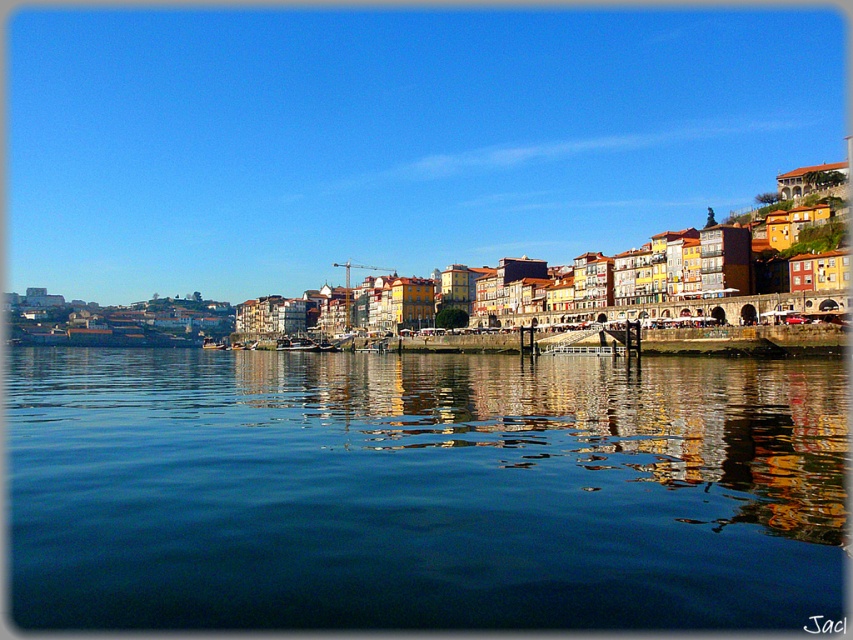
Which is more to the right, transparent blue water at center or wooden boat at center?

From the viewer's perspective, transparent blue water at center appears more on the right side.

Does transparent blue water at center have a greater width compared to wooden boat at center?

Indeed, transparent blue water at center has a greater width compared to wooden boat at center.

Measure the distance between point (x=566, y=428) and camera.

They are 234.54 feet apart.

Locate an element on the screen. This screenshot has width=853, height=640. transparent blue water at center is located at coordinates (422, 490).

Does point (97, 605) come in front of point (223, 348)?

Yes, point (97, 605) is closer to viewer.

Between transparent blue water at center and wooden boat at lower left, which one is positioned lower?

transparent blue water at center is below.

The height and width of the screenshot is (640, 853). Find the location of `transparent blue water at center`. transparent blue water at center is located at coordinates (422, 490).

Which of these two, wooden boat at center or wooden boat at lower left, stands taller?

With more height is wooden boat at lower left.

Is wooden boat at center positioned in front of wooden boat at lower left?

Yes, it is.

The image size is (853, 640). Identify the location of wooden boat at center. (296, 342).